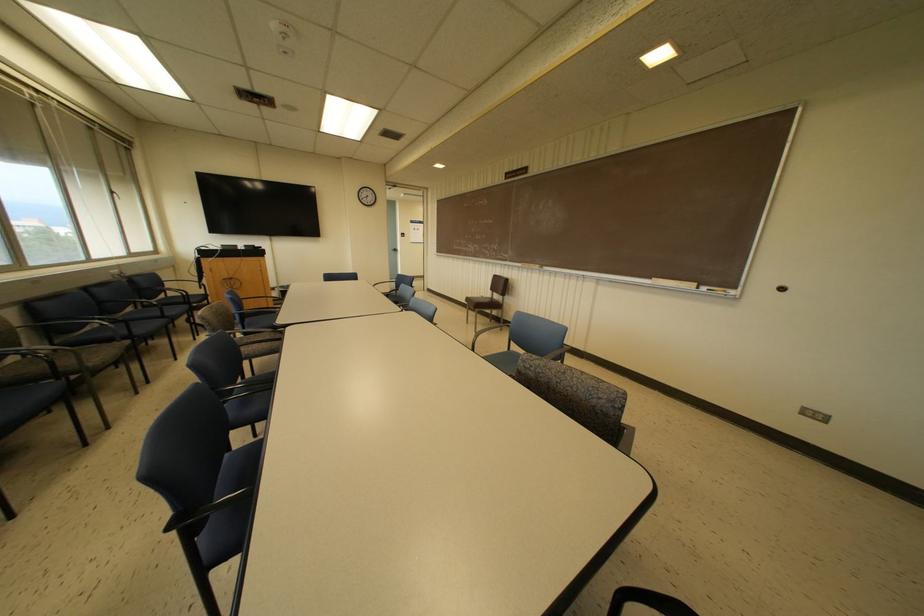
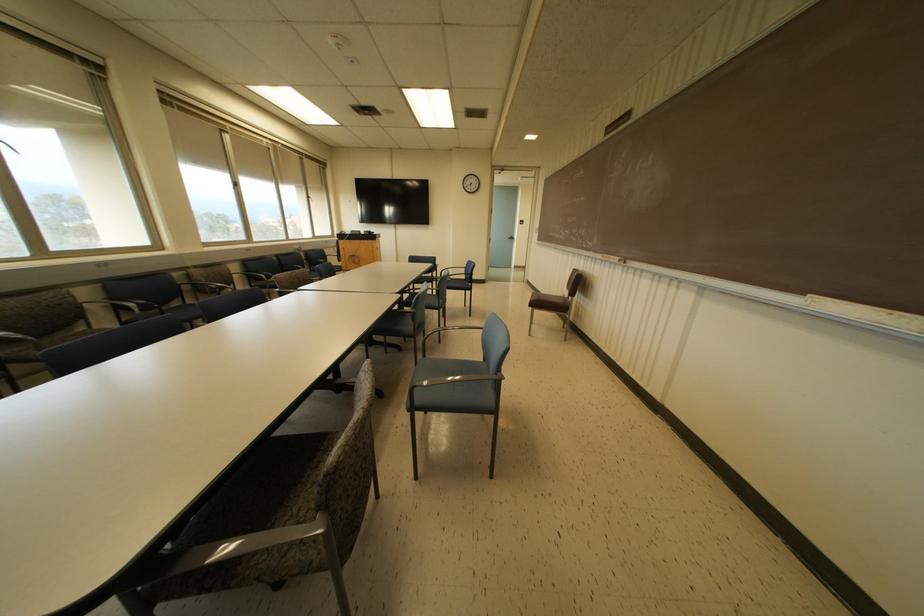
Find the pixel in the second image that matches point 395,249 in the first image.

(512, 238)